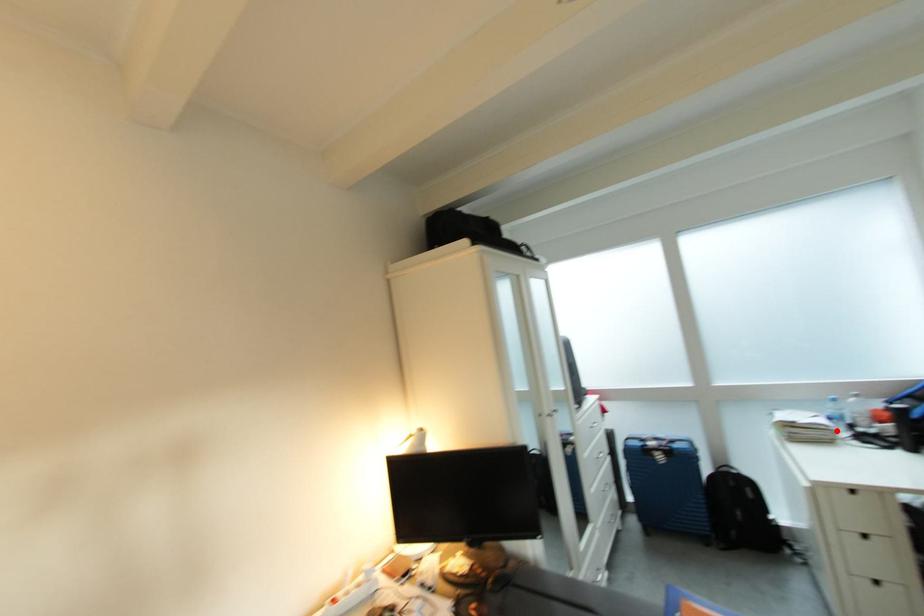
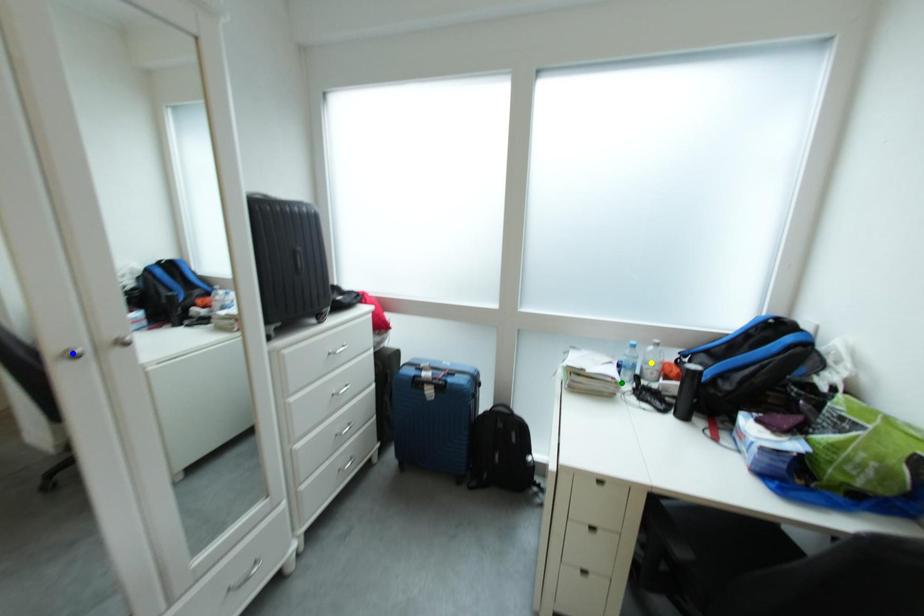
Question: I am providing you with two images of the same scene from different viewpoints. A red point is marked on the first image. You are given multiple points on the second image. Which spot in image 2 lines up with the point in image 1?

Choices:
 (A) green point
 (B) blue point
 (C) yellow point

Answer: (A)